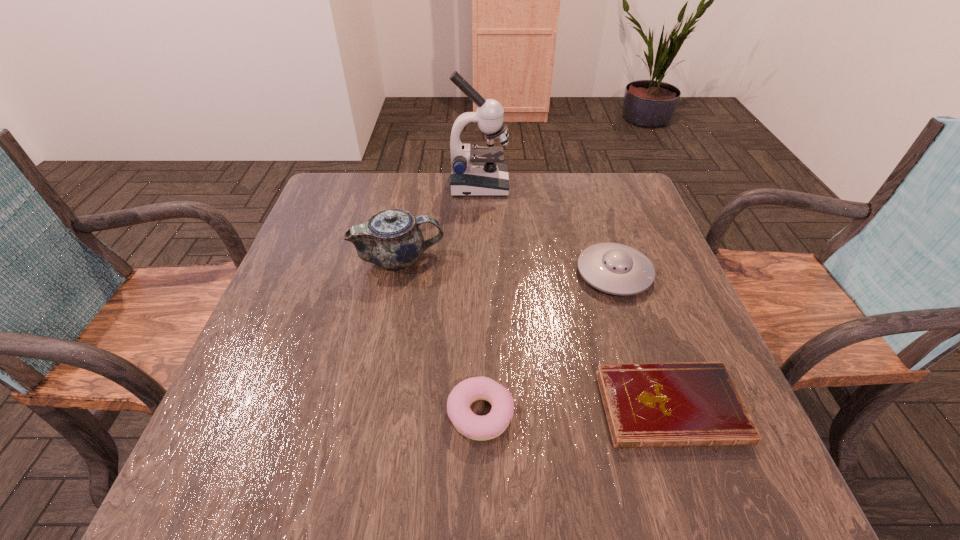
Locate an element on the screen. free spot that satisfies the following two spatial constraints: 1. at the eyepiece of the shortest object; 2. on the left side of the microscope is located at coordinates (478, 407).

This screenshot has height=540, width=960. I want to click on free space that satisfies the following two spatial constraints: 1. on the back side of the saucer; 2. from the spout of the chinaware, so click(610, 259).

You are a GUI agent. You are given a task and a screenshot of the screen. Output one action in this format:
    pyautogui.click(x=<x>, y=<y>)
    Task: Click on the free location that satisfies the following two spatial constraints: 1. at the eyepiece of the third shortest object; 2. on the left side of the tallest object
    This screenshot has width=960, height=540.
    Given the screenshot: What is the action you would take?
    pyautogui.click(x=479, y=273)

Identify the location of vacant region that satisfies the following two spatial constraints: 1. from the spout of the fourth shortest object; 2. on the back side of the third tallest object. (396, 273).

The width and height of the screenshot is (960, 540). What are the coordinates of `free space that satisfies the following two spatial constraints: 1. at the eyepiece of the notebook; 2. on the right side of the farthest object` in the screenshot? It's located at (478, 407).

Image resolution: width=960 pixels, height=540 pixels. Identify the location of free space that satisfies the following two spatial constraints: 1. on the back side of the fourth tallest object; 2. at the eyepiece of the microscope. (480, 185).